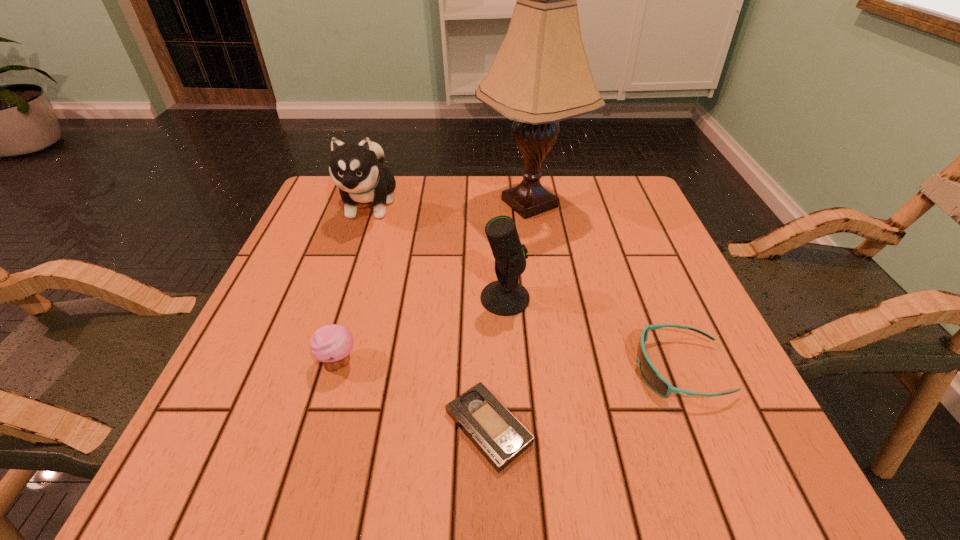
Locate an element on the screen. lamp is located at coordinates (541, 75).

This screenshot has height=540, width=960. Identify the location of puppy. (357, 170).

The height and width of the screenshot is (540, 960). Identify the location of microphone. (505, 297).

Image resolution: width=960 pixels, height=540 pixels. In order to click on the third shortest object in this screenshot , I will do `click(332, 344)`.

The height and width of the screenshot is (540, 960). What are the coordinates of `the fifth tallest object` in the screenshot? It's located at (650, 374).

You are a GUI agent. You are given a task and a screenshot of the screen. Output one action in this format:
    pyautogui.click(x=<x>, y=<y>)
    Task: Click on the videotape
    
    Given the screenshot: What is the action you would take?
    pyautogui.click(x=500, y=437)

Find the location of a particular element. The image size is (960, 540). vacant space situated on the front of the tallest object is located at coordinates (538, 259).

The height and width of the screenshot is (540, 960). I want to click on vacant space located at the face of the puppy, so click(339, 296).

At what (x,y) coordinates should I click in order to perform the action: click on vacant point located 0.290m on the left of the fourth nearest object. Please return your answer as a coordinate pair (x, y). Looking at the image, I should click on (337, 298).

Where is `vacant space located on the back of the third shortest object`? The image size is (960, 540). vacant space located on the back of the third shortest object is located at coordinates (378, 225).